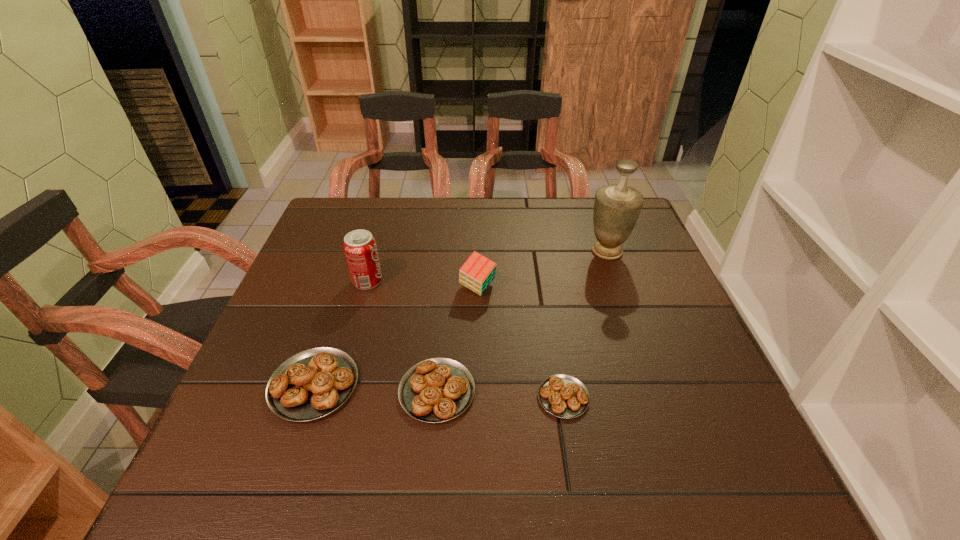
Locate an element on the screen. vacant space located 0.150m on the back of the second pastry from right to left is located at coordinates (444, 309).

Locate an element on the screen. free location located 0.390m on the back of the shortest object is located at coordinates (540, 256).

I want to click on vacant space located 0.320m on the right of the soda can, so click(x=510, y=281).

At what (x,y) coordinates should I click in order to perform the action: click on vacant space situated on the left of the tallest object. Please return your answer as a coordinate pair (x, y). Looking at the image, I should click on (479, 251).

The image size is (960, 540). Find the location of `vacant region located 0.340m on the front of the third tallest object`. vacant region located 0.340m on the front of the third tallest object is located at coordinates (477, 433).

Locate an element on the screen. The image size is (960, 540). object present at the far edge is located at coordinates (617, 207).

This screenshot has width=960, height=540. I want to click on pastry present at the left edge, so click(x=311, y=384).

This screenshot has height=540, width=960. Find the location of `soda can that is at the left edge`. soda can that is at the left edge is located at coordinates (360, 249).

At what (x,y) coordinates should I click in order to perform the action: click on object present at the right edge. Please return your answer as a coordinate pair (x, y). The width and height of the screenshot is (960, 540). Looking at the image, I should click on (617, 207).

At what (x,y) coordinates should I click in order to perform the action: click on object that is at the near left corner. Please return your answer as a coordinate pair (x, y). This screenshot has width=960, height=540. Looking at the image, I should click on 311,384.